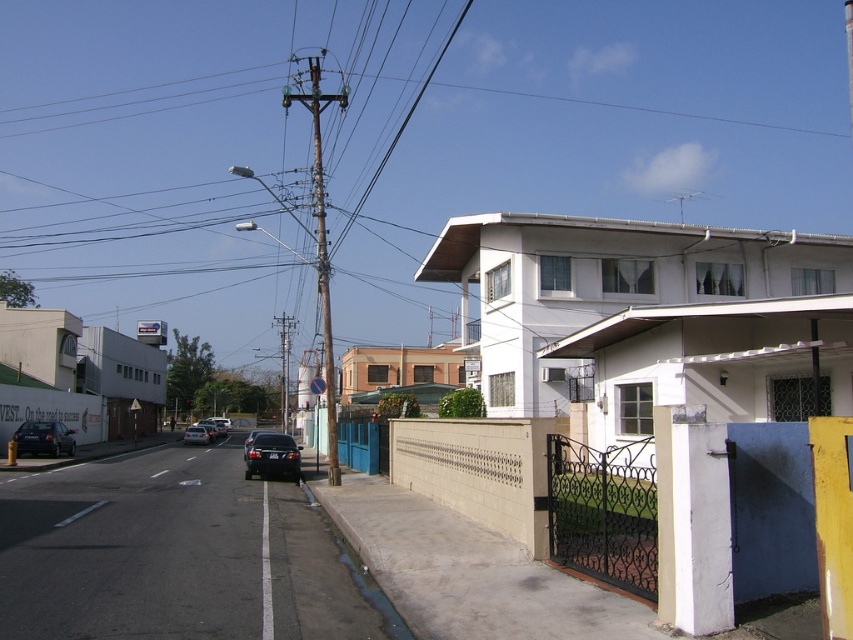
Does metallic utility pole at center have a greater width compared to shiny black sedan at center?

Yes.

Who is more forward, (328, 337) or (260, 433)?

Point (328, 337)

Where is `metallic utility pole at center`? The image size is (853, 640). metallic utility pole at center is located at coordinates (320, 234).

Find the location of a particular element. metallic utility pole at center is located at coordinates (320, 234).

Can you confirm if satin black sedan at lower center is wider than shiny silver sedan at center?

No, satin black sedan at lower center is not wider than shiny silver sedan at center.

Does satin black sedan at lower center have a greater height compared to shiny silver sedan at center?

No, satin black sedan at lower center is not taller than shiny silver sedan at center.

Where is `satin black sedan at lower center`? This screenshot has height=640, width=853. satin black sedan at lower center is located at coordinates (271, 456).

At what (x,y) coordinates should I click in order to perform the action: click on satin black sedan at lower center. Please return your answer as a coordinate pair (x, y). Looking at the image, I should click on (271, 456).

Who is lower down, metallic utility pole at center or shiny black sedan at center-left?

shiny black sedan at center-left

Who is more distant from viewer, (x=326, y=412) or (x=189, y=429)?

Positioned behind is point (x=189, y=429).

Which is in front, point (329, 445) or point (204, 428)?

Point (329, 445) is in front.

Find the location of `metallic utility pole at center`. metallic utility pole at center is located at coordinates (320, 234).